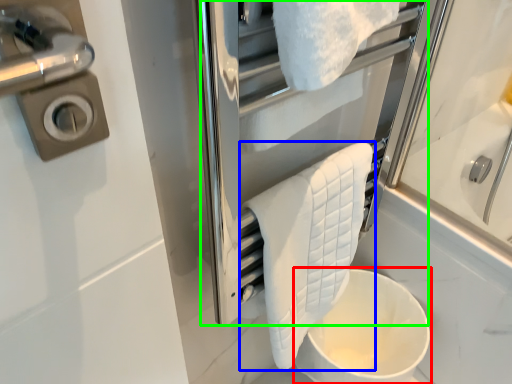
Question: Considering the real-world distances, which object is closest to toilet bowl (highlighted by a red box)? towel (highlighted by a blue box) or screen door (highlighted by a green box).

Choices:
 (A) towel
 (B) screen door

Answer: (A)